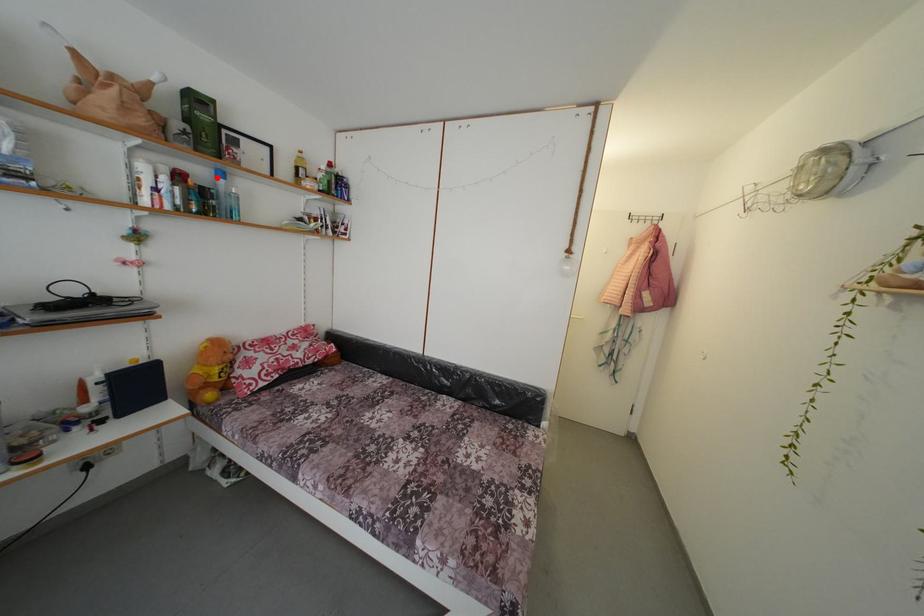
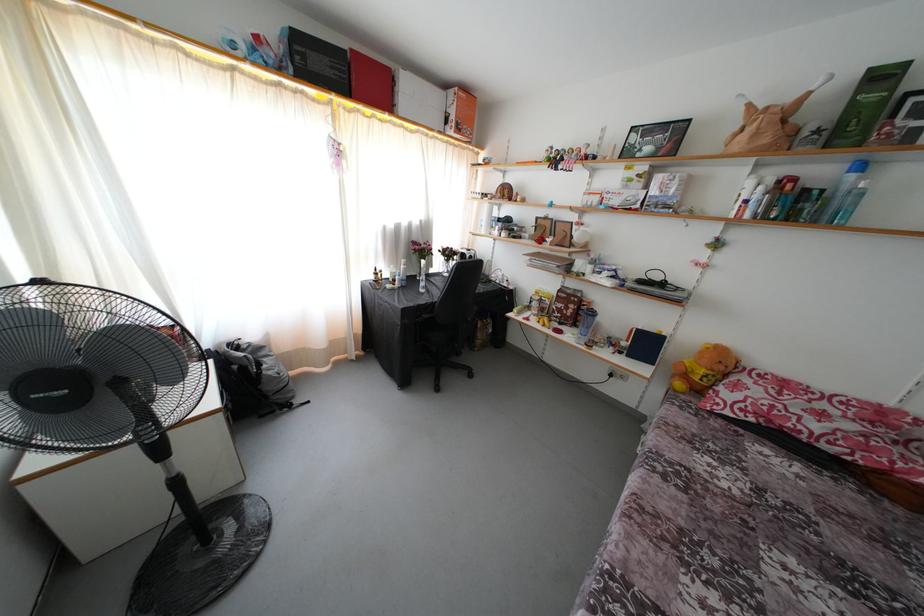
Question: I am providing you with two images of the same scene from different viewpoints. A red point is marked on the first image. Can you still see the location of the red point in image 2?

Choices:
 (A) Yes
 (B) No

Answer: (A)